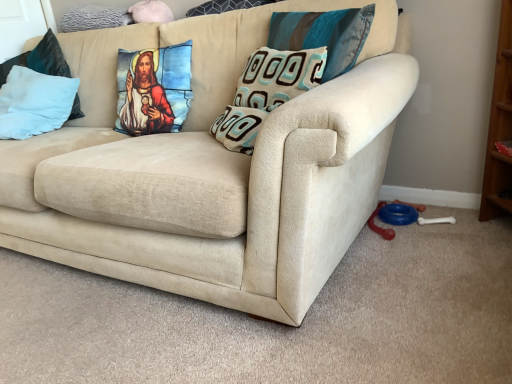
Question: In which direction should I rotate to look at teal fabric pillow at upper center, the 3th pillow in the right-to-left sequence?

Choices:
 (A) right
 (B) left

Answer: (B)

Question: From a real-world perspective, is light blue plush pillow at left, the 5th pillow viewed from the right, under printed fabric pillow at center, marked as the 2th pillow in a left-to-right arrangement?

Choices:
 (A) no
 (B) yes

Answer: (B)

Question: Can you confirm if light blue plush pillow at left, which appears as the first pillow when viewed from the left, is positioned to the right of printed fabric pillow at center, placed as the 4th pillow when sorted from right to left?

Choices:
 (A) no
 (B) yes

Answer: (A)

Question: Would you say light blue plush pillow at left, which appears as the first pillow when viewed from the left, contains printed fabric pillow at center, marked as the 2th pillow in a left-to-right arrangement?

Choices:
 (A) yes
 (B) no

Answer: (B)

Question: Is light blue plush pillow at left, the 5th pillow viewed from the right, outside of printed fabric pillow at center, marked as the 2th pillow in a left-to-right arrangement?

Choices:
 (A) yes
 (B) no

Answer: (A)

Question: Is light blue plush pillow at left, which appears as the first pillow when viewed from the left, facing away from printed fabric pillow at center, placed as the 4th pillow when sorted from right to left?

Choices:
 (A) no
 (B) yes

Answer: (A)

Question: Does light blue plush pillow at left, which appears as the first pillow when viewed from the left, have a lesser width compared to printed fabric pillow at center, placed as the 4th pillow when sorted from right to left?

Choices:
 (A) yes
 (B) no

Answer: (B)

Question: From a real-world perspective, is light blue plush pillow at left, which appears as the first pillow when viewed from the left, below teal fabric pillow at upper center, which is counted as the fifth pillow, starting from the left?

Choices:
 (A) no
 (B) yes

Answer: (B)

Question: Does light blue plush pillow at left, the 5th pillow viewed from the right, turn towards teal fabric pillow at upper center, the first pillow from the right?

Choices:
 (A) no
 (B) yes

Answer: (A)

Question: Is light blue plush pillow at left, which appears as the first pillow when viewed from the left, oriented away from teal fabric pillow at upper center, which is counted as the fifth pillow, starting from the left?

Choices:
 (A) no
 (B) yes

Answer: (A)

Question: Can you confirm if light blue plush pillow at left, which appears as the first pillow when viewed from the left, is smaller than teal fabric pillow at upper center, the first pillow from the right?

Choices:
 (A) no
 (B) yes

Answer: (A)

Question: Is the position of light blue plush pillow at left, which appears as the first pillow when viewed from the left, more distant than that of teal fabric pillow at upper center, which is counted as the fifth pillow, starting from the left?

Choices:
 (A) yes
 (B) no

Answer: (A)

Question: Can you confirm if light blue plush pillow at left, the 5th pillow viewed from the right, is taller than teal fabric pillow at upper center, the first pillow from the right?

Choices:
 (A) no
 (B) yes

Answer: (B)

Question: Can you confirm if teal fabric pillow at upper center, the 3th pillow in the right-to-left sequence, is positioned to the right of teal and brown textured pillow at center, acting as the second pillow starting from the right?

Choices:
 (A) no
 (B) yes

Answer: (A)